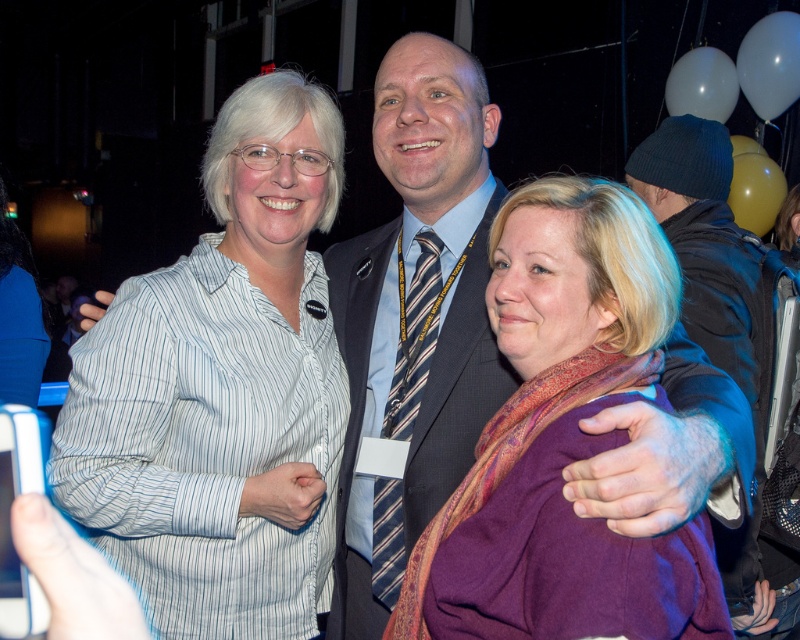
Question: Does white striped shirt at left appear under dark gray suit at center?

Choices:
 (A) no
 (B) yes

Answer: (A)

Question: Which object is closer to the camera taking this photo?

Choices:
 (A) white striped shirt at left
 (B) purple wool scarf at center
 (C) dark gray suit at center

Answer: (B)

Question: Does white striped shirt at left appear on the right side of dark blue knit cap at right?

Choices:
 (A) yes
 (B) no

Answer: (B)

Question: Is purple wool scarf at center positioned before dark blue knit cap at right?

Choices:
 (A) no
 (B) yes

Answer: (B)

Question: Which point is farther to the camera?

Choices:
 (A) white striped shirt at left
 (B) dark gray suit at center

Answer: (B)

Question: Which point is farther to the camera?

Choices:
 (A) dark gray suit at center
 (B) white striped shirt at left
 (C) dark blue knit cap at right
 (D) purple wool scarf at center

Answer: (C)